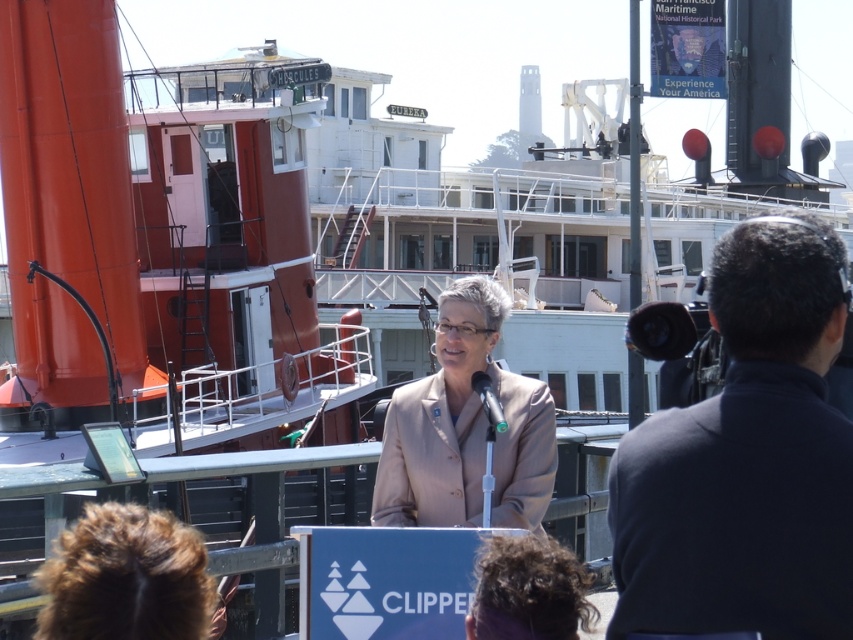
Question: Which of the following is the closest to the observer?

Choices:
 (A) beige fabric jacket at center
 (B) dark blue jacket at right
 (C) green matte microphone at center
 (D) brown fuzzy hair at lower left

Answer: (B)

Question: Observing the image, what is the correct spatial positioning of dark blue jacket at right in reference to green matte microphone at center?

Choices:
 (A) left
 (B) right

Answer: (B)

Question: Can you confirm if dark blue jacket at right is smaller than green matte microphone at center?

Choices:
 (A) no
 (B) yes

Answer: (A)

Question: Which point is farther to the camera?

Choices:
 (A) (740, 237)
 (B) (498, 515)
 (C) (492, 397)

Answer: (C)

Question: Is dark blue jacket at right below brown fuzzy hair at lower left?

Choices:
 (A) yes
 (B) no

Answer: (B)

Question: Among these points, which one is farthest from the camera?

Choices:
 (A) (653, 433)
 (B) (488, 412)

Answer: (B)